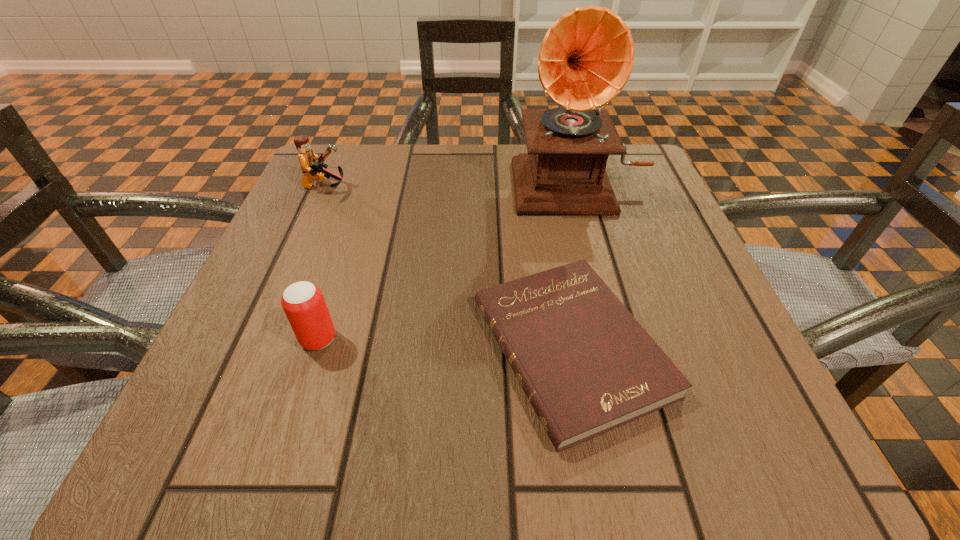
Find the location of a particular element. object at the near edge is located at coordinates (587, 366).

Find the location of a particular element. Lego at the left edge is located at coordinates (312, 169).

Locate an element on the screen. The width and height of the screenshot is (960, 540). beer can situated at the left edge is located at coordinates (303, 303).

The height and width of the screenshot is (540, 960). I want to click on phonograph record that is at the right edge, so click(x=586, y=58).

Where is `hardback book located in the right edge section of the desktop`? This screenshot has height=540, width=960. hardback book located in the right edge section of the desktop is located at coordinates (587, 366).

The image size is (960, 540). I want to click on object positioned at the far left corner, so click(312, 169).

Identify the location of object that is positioned at the far right corner. (586, 58).

You are a GUI agent. You are given a task and a screenshot of the screen. Output one action in this format:
    pyautogui.click(x=<x>, y=<y>)
    Task: Click on the object that is at the near right corner
    
    Given the screenshot: What is the action you would take?
    pyautogui.click(x=587, y=366)

This screenshot has height=540, width=960. Identify the location of blank space at the far edge. (488, 158).

The height and width of the screenshot is (540, 960). In order to click on free space at the left edge in this screenshot , I will do `click(274, 278)`.